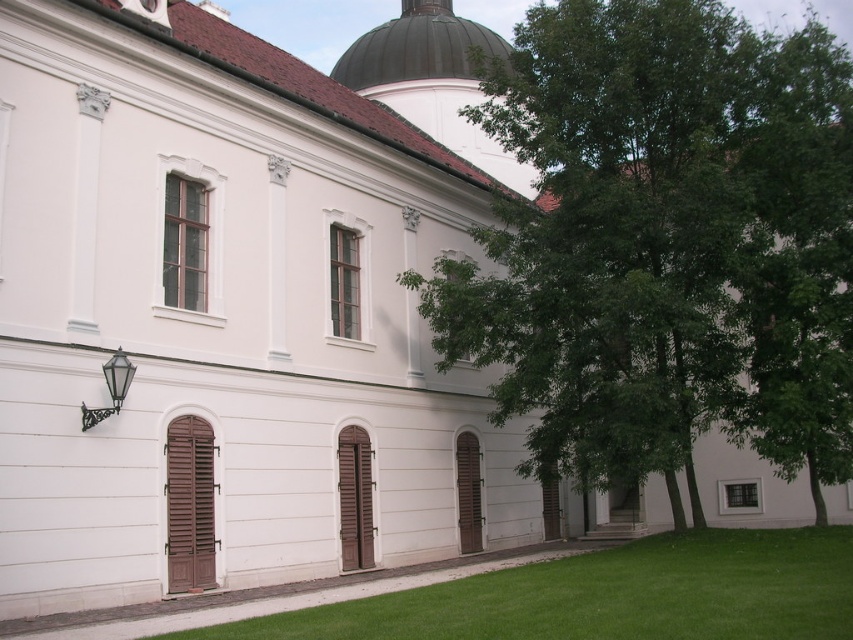
You are standing in front of the white building with a red roof and want to walk from the green grass at lower center to the green leafy tree at center. Which direction should you move to get closer to the tree?

The green leafy tree at center is further to the viewer than green grass at lower center, so you should move forward towards the building to get closer to the tree.

You are standing in front of the white building with red tiles. There is a green leafy tree at center. Can you see the green leafy tree at center from the point located at coordinate (665, 243)?

The point at coordinate (665, 243) is where the green leafy tree at center is located, so you are standing at the base of the tree and can see it directly.

You are a gardener planning to plant a new row of flowers between the green leafy tree at center and the green grass at lower center. Considering their widths, which object should you place the flowers closer to to ensure they have enough space?

The green leafy tree at center has a greater width than the green grass at lower center. Therefore, the flowers should be placed closer to the green grass at lower center to ensure they have enough space.